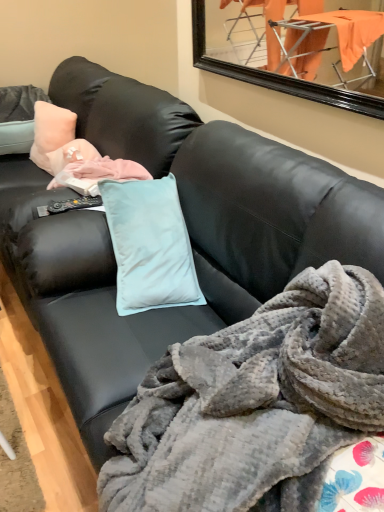
Question: From the image's perspective, is gray plush blanket at center positioned above or below peach velvety pillow at upper left?

Choices:
 (A) below
 (B) above

Answer: (A)

Question: Considering the positions of gray plush blanket at center and peach velvety pillow at upper left in the image, is gray plush blanket at center wider or thinner than peach velvety pillow at upper left?

Choices:
 (A) thin
 (B) wide

Answer: (B)

Question: From a real-world perspective, is gray plush blanket at center positioned above or below peach velvety pillow at upper left?

Choices:
 (A) above
 (B) below

Answer: (B)

Question: Which is correct: peach velvety pillow at upper left is inside gray plush blanket at center, or outside of it?

Choices:
 (A) outside
 (B) inside

Answer: (A)

Question: Does point (54, 132) appear closer or farther from the camera than point (259, 326)?

Choices:
 (A) farther
 (B) closer

Answer: (A)

Question: Considering the positions of peach velvety pillow at upper left and gray plush blanket at center in the image, is peach velvety pillow at upper left taller or shorter than gray plush blanket at center?

Choices:
 (A) tall
 (B) short

Answer: (B)

Question: From a real-world perspective, is peach velvety pillow at upper left physically located above or below gray plush blanket at center?

Choices:
 (A) below
 (B) above

Answer: (B)